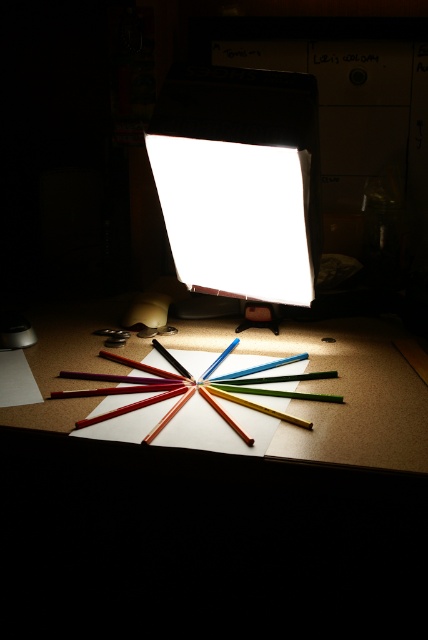
Question: Does white matte lampshade at center appear on the right side of wooden table at center?

Choices:
 (A) no
 (B) yes

Answer: (B)

Question: In this image, where is white matte lampshade at center located relative to wooden table at center?

Choices:
 (A) above
 (B) below

Answer: (A)

Question: Among these objects, which one is nearest to the camera?

Choices:
 (A) wooden table at center
 (B) white matte lampshade at center

Answer: (A)

Question: Where is white matte lampshade at center located in relation to wooden table at center in the image?

Choices:
 (A) right
 (B) left

Answer: (A)

Question: Which of the following is the farthest from the observer?

Choices:
 (A) (297, 211)
 (B) (76, 355)

Answer: (B)